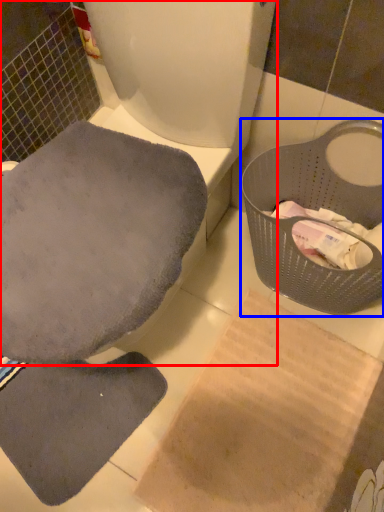
Question: Which object is further to the camera taking this photo, toilet (highlighted by a red box) or basket container (highlighted by a blue box)?

Choices:
 (A) toilet
 (B) basket container

Answer: (B)